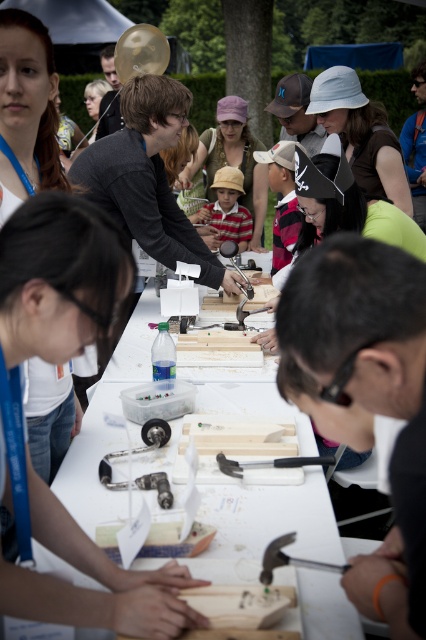
You are a participant at the workshop and need to place both the smooth wooden block at center and the metallic hammer at center into a box that can only hold items up to 10 cm in height. Which item might not fit based on their heights?

The smooth wooden block at center is much taller than the metallic hammer at center, so the smooth wooden block at center might not fit into the box since it exceeds the 10 cm height limit.

You are a photographer at the event and want to capture a photo of the matte white shirt at center and the metallic hammer at center. Which object should you focus on first if you want to ensure both are in focus without adjusting the camera settings?

The matte white shirt at center is taller than the metallic hammer at center, so focusing on the matte white shirt at center first would ensure both are in focus since it is larger and closer to the camera.

You are a photographer at the event and want to capture a participant wearing the matte white shirt at center. Where should you position your camera to ensure they are in the frame? Please provide coordinates based on the image grid system where the bottom left corner is the origin point.

The matte white shirt at center is located at coordinates point (58, 278), so positioning the camera near this point would ensure the participant is centered in the frame.